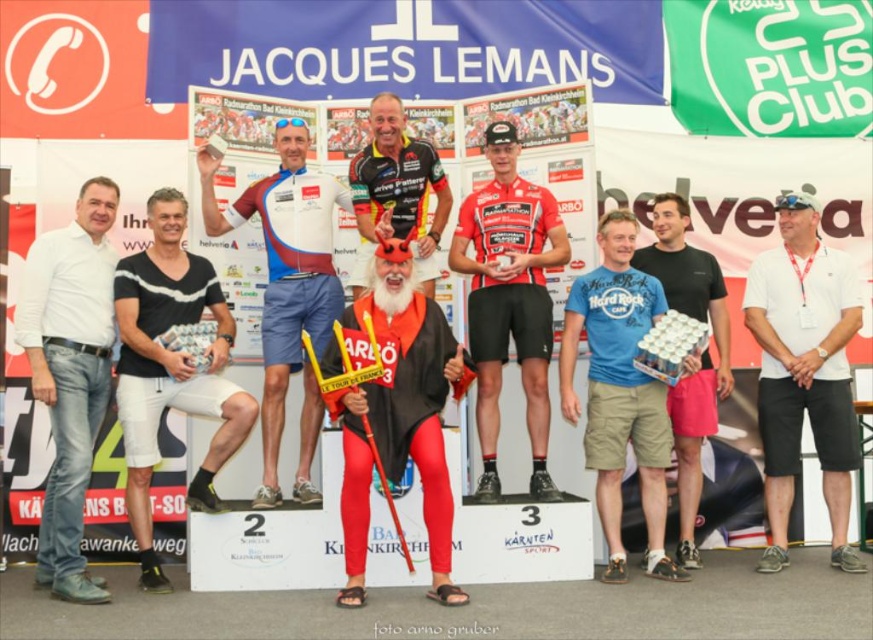
Is matte blue and white cycling jersey at center thinner than black matte shorts at center?

No.

Which is behind, point (280, 189) or point (726, 372)?

Positioned behind is point (726, 372).

Where is `matte blue and white cycling jersey at center`? The width and height of the screenshot is (873, 640). matte blue and white cycling jersey at center is located at coordinates (284, 269).

Who is higher up, white denim jeans at left or black matte shorts at center?

black matte shorts at center is above.

The width and height of the screenshot is (873, 640). Describe the element at coordinates (70, 372) in the screenshot. I see `white denim jeans at left` at that location.

Between point (67, 252) and point (696, 404), which one is positioned in front?

Point (67, 252) is in front.

This screenshot has width=873, height=640. I want to click on white denim jeans at left, so (x=70, y=372).

Who is shorter, blue cotton t-shirt at center or shiny black cycling jersey at center?

With less height is shiny black cycling jersey at center.

Who is positioned more to the right, blue cotton t-shirt at center or shiny black cycling jersey at center?

blue cotton t-shirt at center is more to the right.

Does point (634, 353) come closer to viewer compared to point (411, 166)?

Yes, point (634, 353) is closer to viewer.

Where is `blue cotton t-shirt at center`? The image size is (873, 640). blue cotton t-shirt at center is located at coordinates (619, 392).